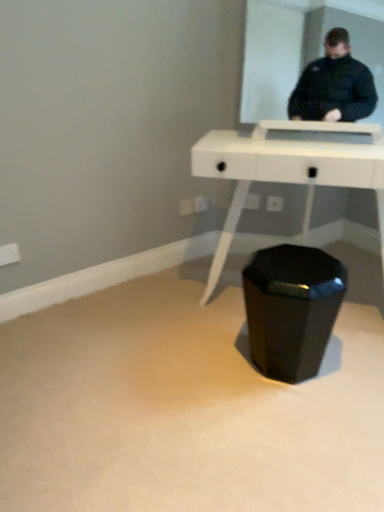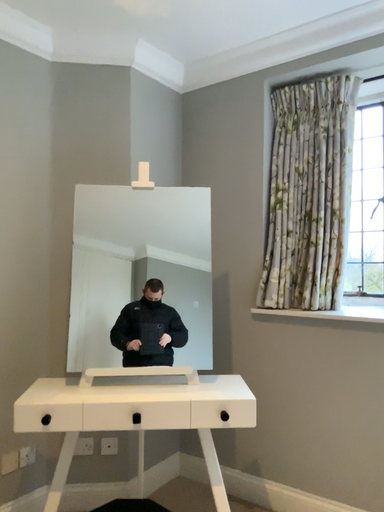
Question: How did the camera likely rotate when shooting the video?

Choices:
 (A) rotated right
 (B) rotated left

Answer: (A)